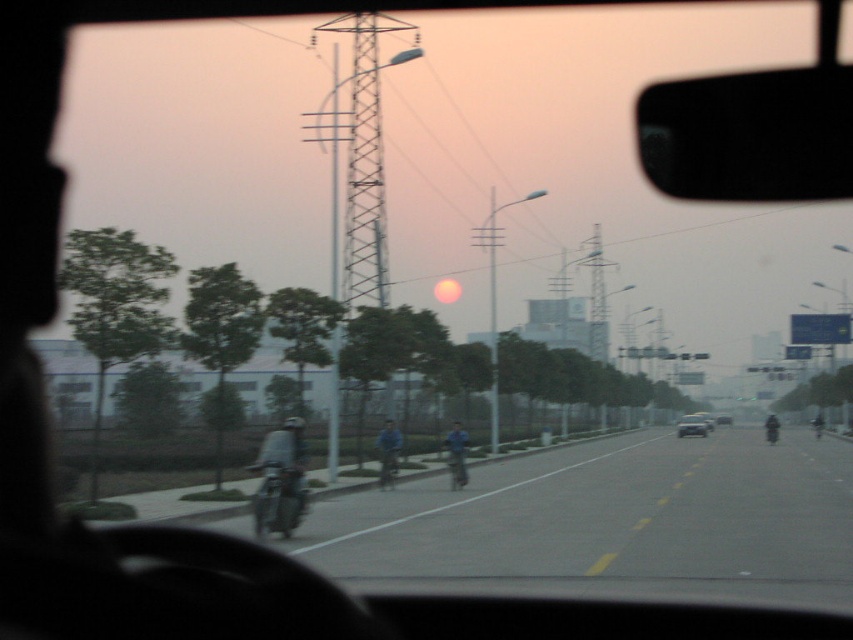
You are driving a metallic silver sedan at center and want to overtake the metallic silver car at center ahead. Can you safely pass using the current road conditions shown in the image?

The metallic silver sedan at center is already in front of the metallic silver car at center, so overtaking is not necessary. You are already ahead of the metallic silver car at center.

Based on the photo, you are driving along a road with two points marked on the windshield. The first point is at coordinates point [682,419] and the second is at point [816,433]. From your perspective inside the vehicle, which point is closer to you?

Point [816,433] is closer to you because it is in front of point [682,419].

You are sitting in a car and notice a blue matte jacket at center in the scene outside. Based on its position, can you estimate whether it is closer to the front windshield or the side window of the car?

The blue matte jacket at center is located at point coordinates that are closer to the front windshield than the side window, so it is positioned closer to the front windshield.